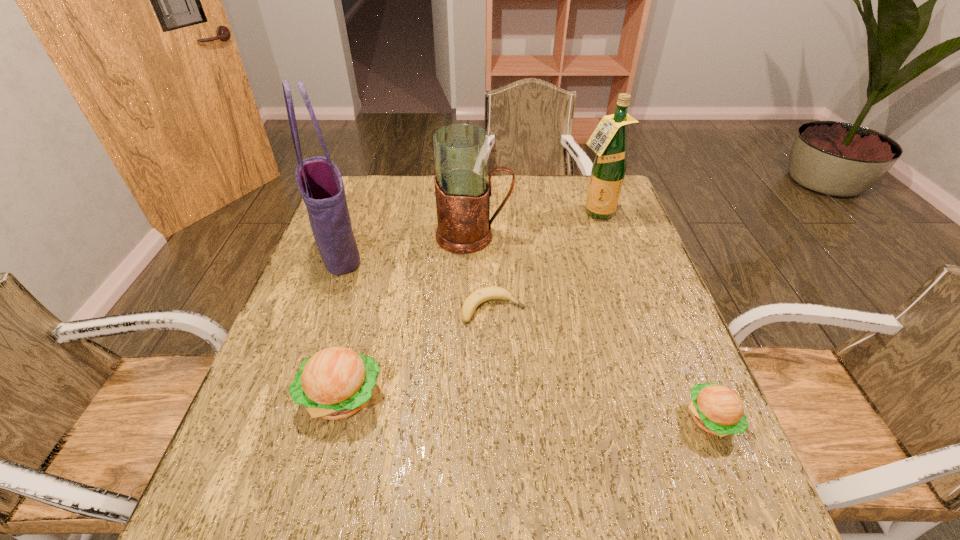
The width and height of the screenshot is (960, 540). I want to click on the taller hamburger, so click(335, 383).

Locate an element on the screen. The width and height of the screenshot is (960, 540). the third shortest object is located at coordinates (335, 383).

The height and width of the screenshot is (540, 960). Identify the location of the shorter hamburger. (716, 409).

Where is `the fifth tallest object`? The image size is (960, 540). the fifth tallest object is located at coordinates (716, 409).

Image resolution: width=960 pixels, height=540 pixels. Find the location of `the tallest object`. the tallest object is located at coordinates (319, 181).

Identify the location of the fourth shortest object. The height and width of the screenshot is (540, 960). (462, 191).

At what (x,y) coordinates should I click in order to perform the action: click on liquor. Please return your answer as a coordinate pair (x, y). The width and height of the screenshot is (960, 540). Looking at the image, I should click on (608, 141).

Identify the location of the shortest object. The width and height of the screenshot is (960, 540). (482, 295).

Where is `banana`? banana is located at coordinates coord(482,295).

I want to click on vacant region located 0.200m on the back of the left hamburger, so click(x=367, y=301).